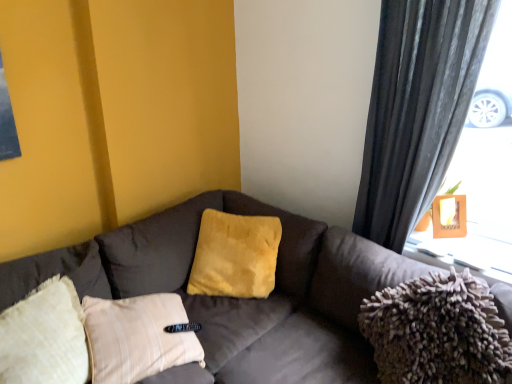
Question: Can you see yellow plush pillow at center touching dark gray textured curtain at right?

Choices:
 (A) yes
 (B) no

Answer: (B)

Question: Can you confirm if yellow plush pillow at center is bigger than dark gray textured curtain at right?

Choices:
 (A) no
 (B) yes

Answer: (A)

Question: Is yellow plush pillow at center at the right side of dark gray textured curtain at right?

Choices:
 (A) yes
 (B) no

Answer: (B)

Question: Is yellow plush pillow at center closer to camera compared to dark gray textured curtain at right?

Choices:
 (A) no
 (B) yes

Answer: (A)

Question: From a real-world perspective, is yellow plush pillow at center physically above dark gray textured curtain at right?

Choices:
 (A) no
 (B) yes

Answer: (A)

Question: From a real-world perspective, is yellow plush pillow at center below dark gray textured curtain at right?

Choices:
 (A) yes
 (B) no

Answer: (A)

Question: Is wooden frame at upper right positioned far away from wooden frame at upper right?

Choices:
 (A) no
 (B) yes

Answer: (A)

Question: From a real-world perspective, is wooden frame at upper right below wooden frame at upper right?

Choices:
 (A) yes
 (B) no

Answer: (B)

Question: From the image's perspective, is wooden frame at upper right over wooden frame at upper right?

Choices:
 (A) no
 (B) yes

Answer: (B)

Question: Is wooden frame at upper right completely or partially outside of wooden frame at upper right?

Choices:
 (A) yes
 (B) no

Answer: (A)

Question: Does wooden frame at upper right appear on the left side of wooden frame at upper right?

Choices:
 (A) no
 (B) yes

Answer: (B)

Question: Is wooden frame at upper right positioned in front of wooden frame at upper right?

Choices:
 (A) no
 (B) yes

Answer: (A)

Question: Is yellow plush pillow at center surrounding wooden frame at upper right?

Choices:
 (A) yes
 (B) no

Answer: (B)